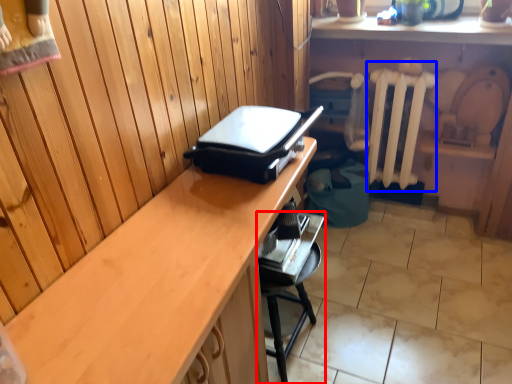
Question: Which object appears farthest to the camera in this image, furniture (highlighted by a red box) or radiator (highlighted by a blue box)?

Choices:
 (A) furniture
 (B) radiator

Answer: (B)